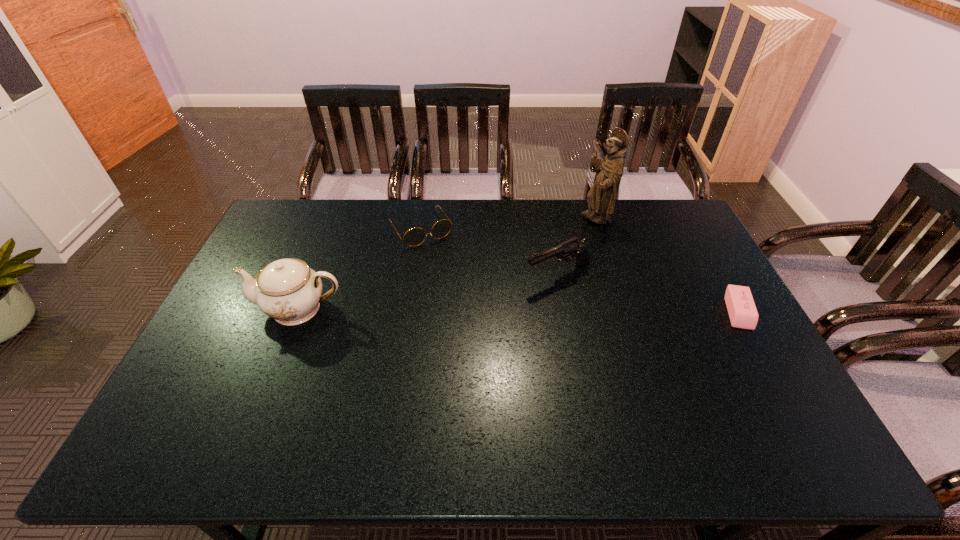
Locate an element on the screen. This screenshot has height=540, width=960. vacant space at the far left corner of the desktop is located at coordinates (318, 210).

What are the coordinates of `free space at the far right corner of the desktop` in the screenshot? It's located at click(x=674, y=222).

In order to click on vacant space at the near right corner of the desktop in this screenshot , I will do pos(779,402).

This screenshot has height=540, width=960. I want to click on unoccupied position between the shortest object and the leftmost object, so click(518, 310).

The image size is (960, 540). I want to click on free spot between the sunglasses and the third shortest object, so click(x=490, y=251).

The image size is (960, 540). Find the location of `vacant area that lies between the third object from right to left and the second tallest object`. vacant area that lies between the third object from right to left and the second tallest object is located at coordinates (429, 291).

At what (x,y) coordinates should I click in order to perform the action: click on vacant area between the second tallest object and the fourth object from right to left. Please return your answer as a coordinate pair (x, y). The image size is (960, 540). Looking at the image, I should click on (360, 269).

Identify the location of vacant space that is in between the figurine and the shortest object. Image resolution: width=960 pixels, height=540 pixels. (667, 265).

I want to click on free space between the chinaware and the sunglasses, so click(x=360, y=269).

What are the coordinates of `object that is the closest to the rightmost object` in the screenshot? It's located at (567, 250).